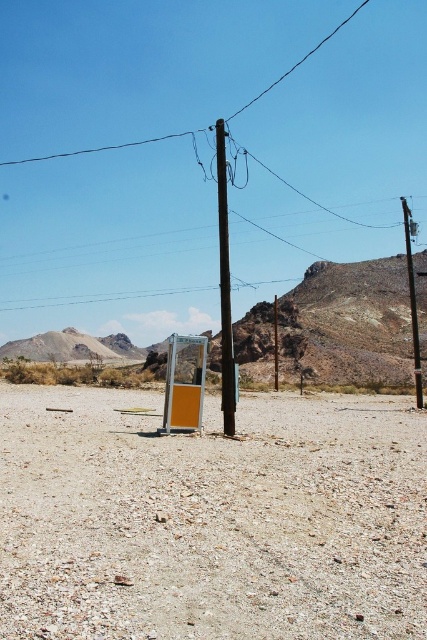
Find the location of a particular element. The image size is (427, 640). gray gravelly dirt at center is located at coordinates (211, 518).

Between gray gravelly dirt at center and smooth brown wooden telegraph pole at center, which one appears on the left side from the viewer's perspective?

smooth brown wooden telegraph pole at center is more to the left.

Identify the location of gray gravelly dirt at center. (211, 518).

Where is `gray gravelly dirt at center`? gray gravelly dirt at center is located at coordinates (211, 518).

Can you confirm if smooth brown wooden telegraph pole at center is positioned to the right of black wire at upper center?

Correct, you'll find smooth brown wooden telegraph pole at center to the right of black wire at upper center.

Is smooth brown wooden telegraph pole at center further to camera compared to black wire at upper center?

No.

You are a GUI agent. You are given a task and a screenshot of the screen. Output one action in this format:
    pyautogui.click(x=<x>, y=<y>)
    Task: Click on the smooth brown wooden telegraph pole at center
    This screenshot has height=640, width=427.
    Given the screenshot: What is the action you would take?
    pyautogui.click(x=225, y=288)

Locate an element on the screen. The image size is (427, 640). smooth brown wooden telegraph pole at center is located at coordinates (225, 288).

Between point (49, 612) and point (190, 132), which one is positioned behind?

Positioned behind is point (190, 132).

Can you confirm if gray gravelly dirt at center is smaller than black wire at upper center?

Indeed, gray gravelly dirt at center has a smaller size compared to black wire at upper center.

Locate an element on the screen. gray gravelly dirt at center is located at coordinates (211, 518).